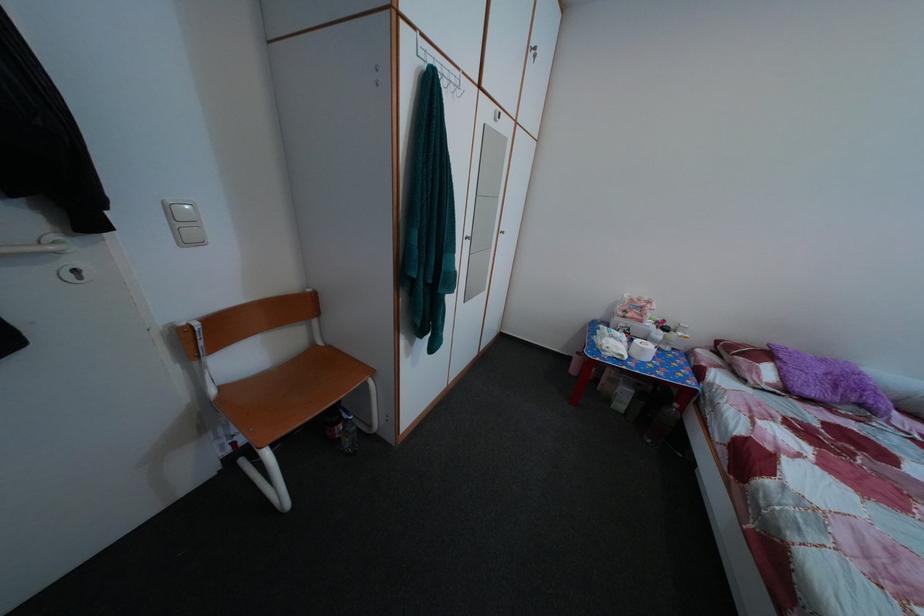
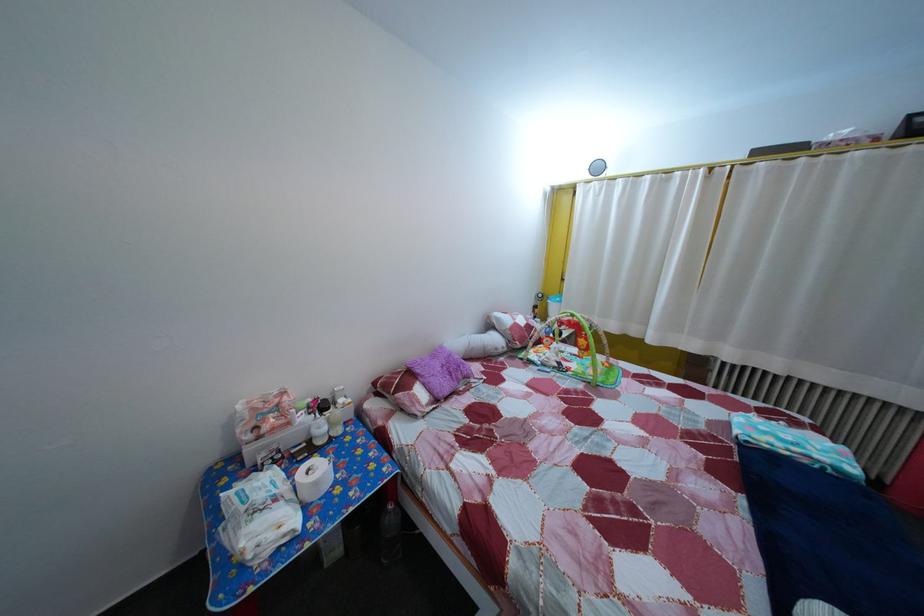
Where in the second image is the point corresponding to [650,329] from the first image?

(298, 432)